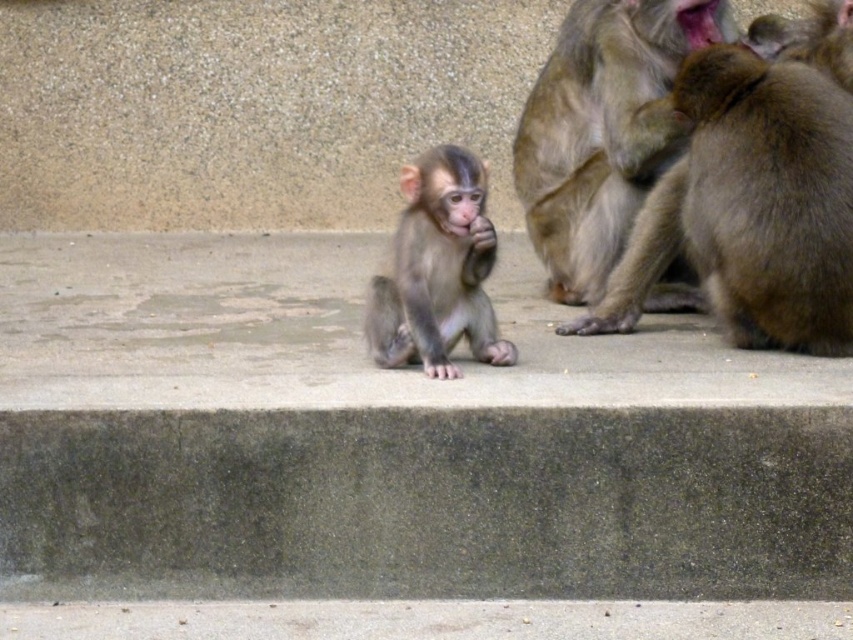
You are a zookeeper who wants to observe the brown furry monkey at right from a safe distance. The recommended safe distance for observing monkeys is 5 meters. Can you approach closer than the current distance?

The brown furry monkey at right is 4.74 meters away from camera, which is less than the recommended 5 meters. Therefore, you should not approach closer than the current distance to maintain safety.

You are standing in front of the monkey enclosure at the zoo. There is a point marked at coordinates (607, 269) in the image. If you want to throw a banana to that point, will it land within the enclosure? The enclosure is 6 meters deep from where you are standing.

The point at coordinates (607, 269) is 5.61 meters away from the viewer, which is within the 6 meter depth of the enclosure. Therefore, the banana will land within the enclosure.

You are observing monkeys in a zoo enclosure. You notice a fuzzy brown monkey at center and a light brown fur monkey at center. Which monkey is located to the right of the other?

The fuzzy brown monkey at center is positioned on the right side of the light brown fur monkey at center.